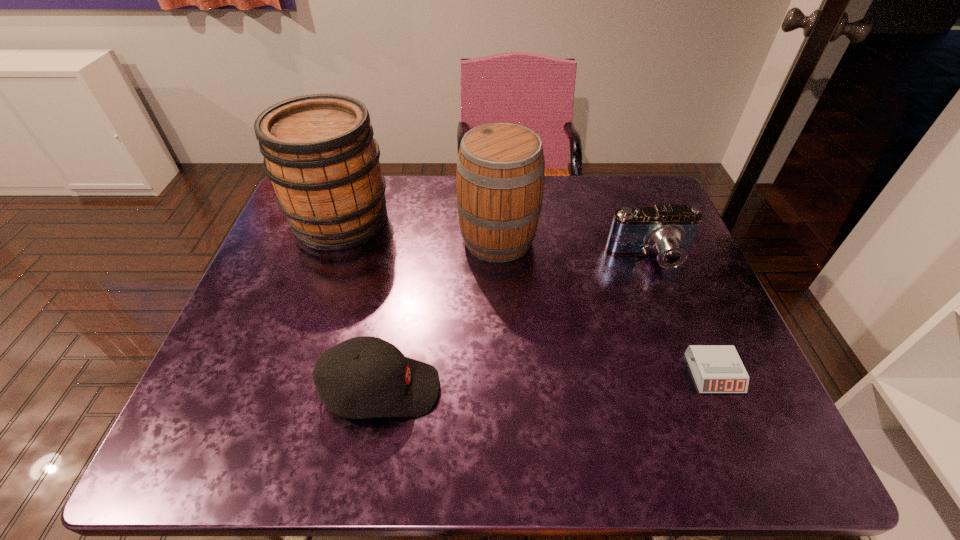
Where is `object that is positioned at the near edge`? Image resolution: width=960 pixels, height=540 pixels. object that is positioned at the near edge is located at coordinates (363, 377).

The image size is (960, 540). Find the location of `object present at the left edge`. object present at the left edge is located at coordinates (319, 152).

Where is `camcorder located at the right edge`? This screenshot has height=540, width=960. camcorder located at the right edge is located at coordinates (668, 231).

Find the location of a particular element. alarm clock situated at the right edge is located at coordinates (716, 368).

Find the location of a particular element. object situated at the far left corner is located at coordinates (319, 152).

The height and width of the screenshot is (540, 960). I want to click on vacant space at the far edge of the desktop, so click(x=437, y=206).

I want to click on vacant area at the near edge of the desktop, so coord(599,441).

Find the location of a particular element. vacant space at the left edge of the desktop is located at coordinates click(273, 338).

What are the coordinates of `blank space at the right edge` in the screenshot? It's located at (691, 395).

Identify the location of free space at the far right corner of the desktop. This screenshot has width=960, height=540. (620, 181).